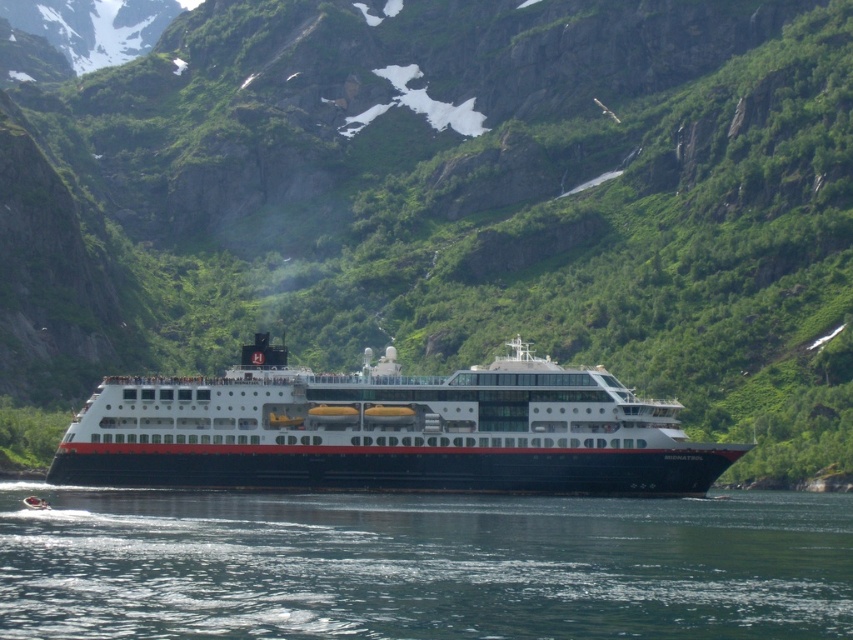
Is clear blue water at lower center taller than white glossy cruise ship at center?

No.

Between clear blue water at lower center and white glossy cruise ship at center, which one appears on the right side from the viewer's perspective?

Positioned to the right is white glossy cruise ship at center.

Who is more forward, (10, 592) or (608, 381)?

Point (10, 592) is in front.

Find the location of `clear blue water at lower center`. clear blue water at lower center is located at coordinates (422, 564).